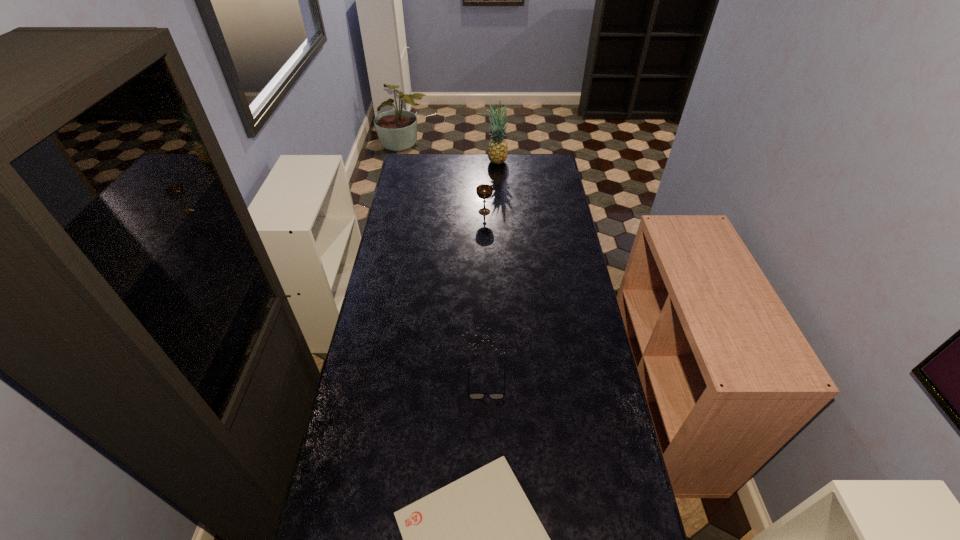
The image size is (960, 540). What are the coordinates of `pineapple` in the screenshot? It's located at (497, 150).

Identify the location of the tallest object. The image size is (960, 540). (497, 150).

The height and width of the screenshot is (540, 960). In order to click on chalice in this screenshot , I will do tap(484, 191).

At what (x,y) coordinates should I click in order to perform the action: click on the second farthest object. Please return your answer as a coordinate pair (x, y). Image resolution: width=960 pixels, height=540 pixels. Looking at the image, I should click on pyautogui.click(x=484, y=191).

This screenshot has width=960, height=540. Identify the location of the second shortest object. (476, 396).

Locate an element on the screen. Image resolution: width=960 pixels, height=540 pixels. the third farthest object is located at coordinates (476, 396).

Find the location of a particular element. The width and height of the screenshot is (960, 540). vacant region located 0.090m on the left of the farthest object is located at coordinates (469, 161).

What are the coordinates of `free spot located 0.210m on the right of the third nearest object` in the screenshot? It's located at (536, 212).

The width and height of the screenshot is (960, 540). Find the location of `vacant space located 0.350m on the front-facing side of the spectacles`. vacant space located 0.350m on the front-facing side of the spectacles is located at coordinates (489, 518).

The width and height of the screenshot is (960, 540). I want to click on object that is positioned at the far edge, so click(x=497, y=150).